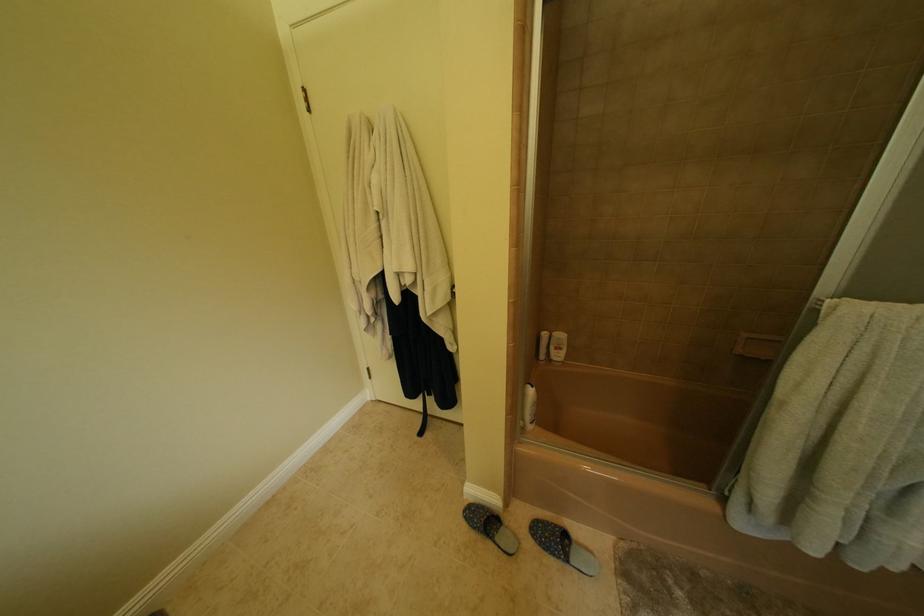
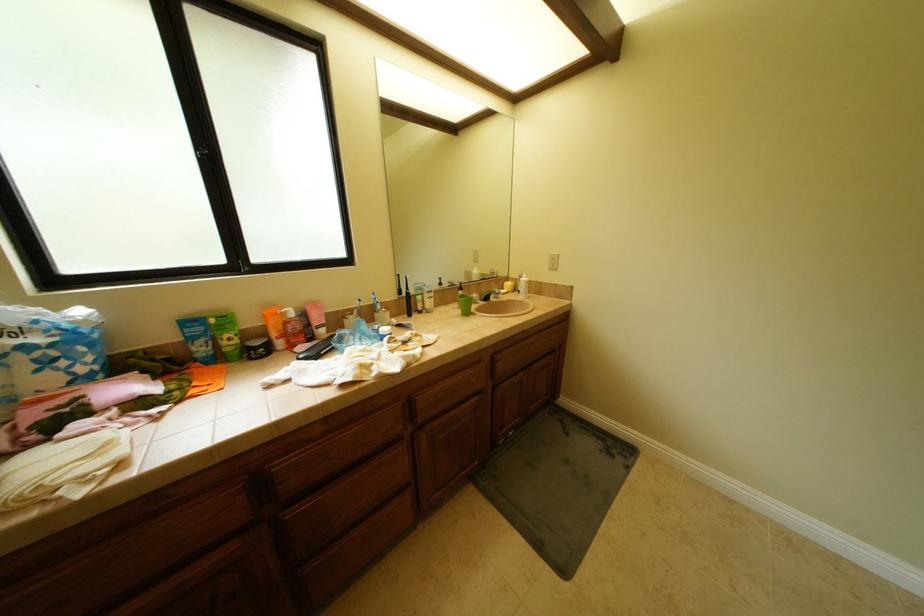
The first image is from the beginning of the video and the second image is from the end. How did the camera likely rotate when shooting the video?

The rotation direction of the camera is left-down.